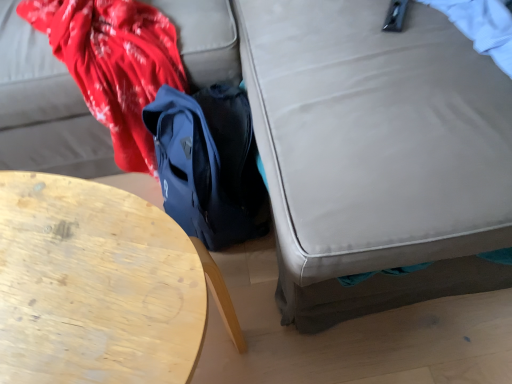
Question: Should I look upward or downward to see wooden table at lower left?

Choices:
 (A) down
 (B) up

Answer: (A)